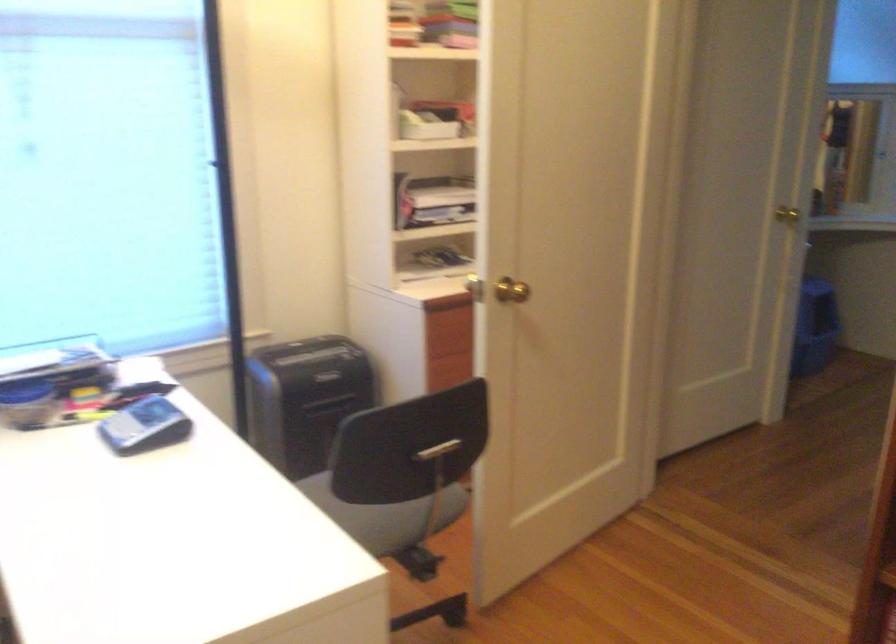
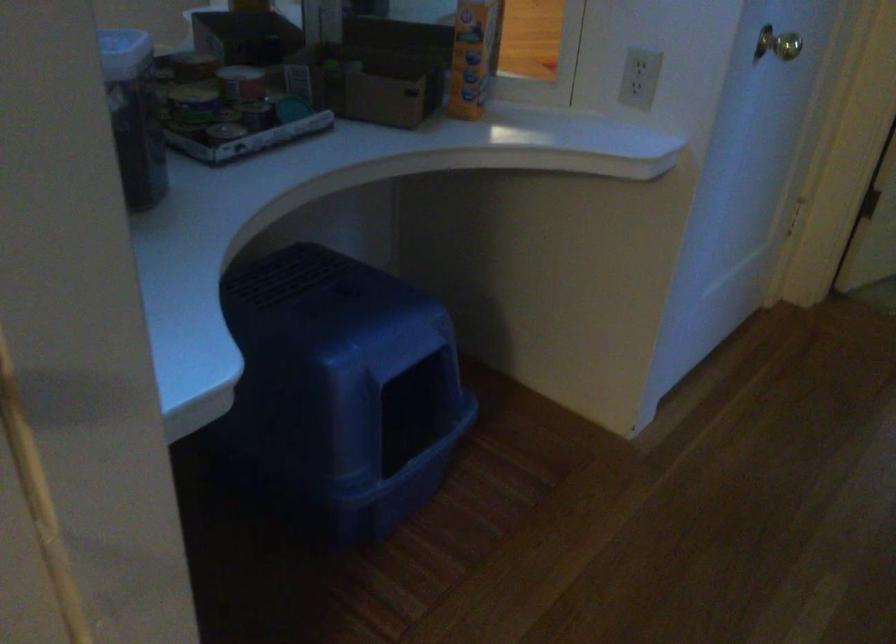
Which direction would the cameraman need to move to produce the second image?

The movement direction of the cameraman is right, forward.